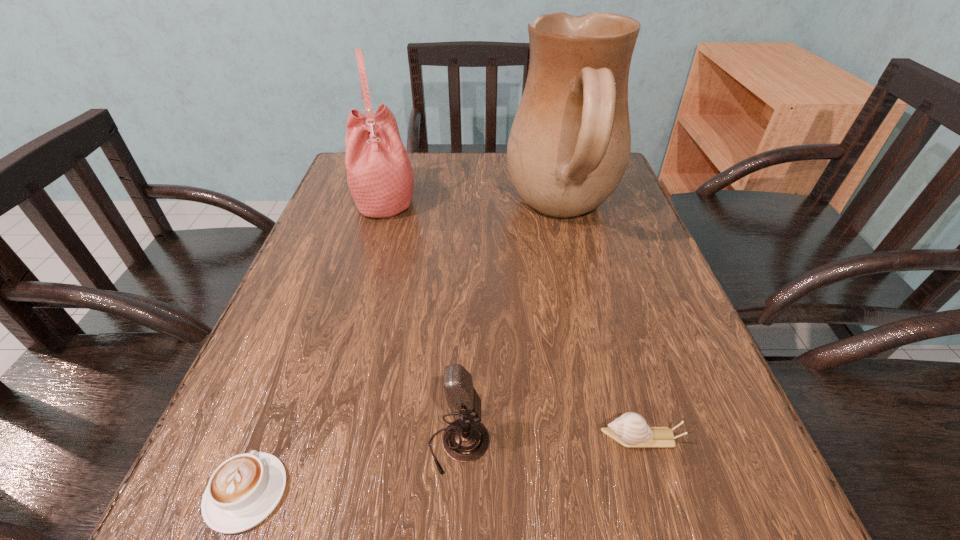
You are a GUI agent. You are given a task and a screenshot of the screen. Output one action in this format:
    pyautogui.click(x=<x>, y=<y>)
    Task: Click on the free area in between the cream pitcher and the escargot
    
    Given the screenshot: What is the action you would take?
    pyautogui.click(x=602, y=326)

You are a GUI agent. You are given a task and a screenshot of the screen. Output one action in this format:
    pyautogui.click(x=<x>, y=<y>)
    Task: Click on the vacant point located between the fourth shortest object and the cappuccino
    
    Given the screenshot: What is the action you would take?
    pyautogui.click(x=316, y=346)

You are a GUI agent. You are given a task and a screenshot of the screen. Output one action in this format:
    pyautogui.click(x=<x>, y=<y>)
    Task: Click on the object that stands as the closest to the cream pitcher
    The image size is (960, 540).
    Given the screenshot: What is the action you would take?
    pyautogui.click(x=380, y=177)

Identify which object is the third closest to the microphone. Please provide its 2D coordinates. Your answer should be formatted as a tuple, i.e. [(x, y)], where the tuple contains the x and y coordinates of a point satisfying the conditions above.

[(569, 146)]